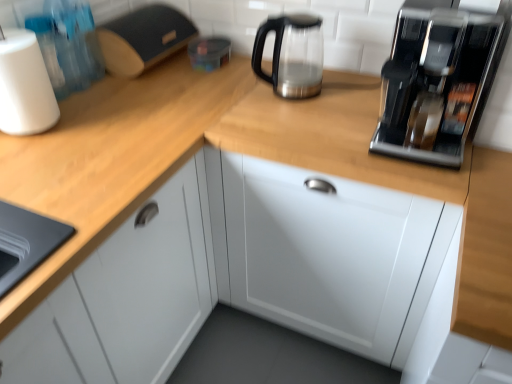
Question: Is white matte paper towel at left placed right next to wooden at left?

Choices:
 (A) no
 (B) yes

Answer: (A)

Question: Can you confirm if white matte paper towel at left is smaller than wooden at left?

Choices:
 (A) no
 (B) yes

Answer: (B)

Question: From the image's perspective, is white matte paper towel at left on top of wooden at left?

Choices:
 (A) yes
 (B) no

Answer: (A)

Question: Would you say wooden at left is part of white matte paper towel at left's contents?

Choices:
 (A) no
 (B) yes

Answer: (A)

Question: From a real-world perspective, is white matte paper towel at left on wooden at left?

Choices:
 (A) yes
 (B) no

Answer: (A)

Question: Which is correct: white glossy cabinet at center is inside sleek metallic coffee machine at upper right, or outside of it?

Choices:
 (A) outside
 (B) inside

Answer: (A)

Question: Considering the positions of white glossy cabinet at center and sleek metallic coffee machine at upper right in the image, is white glossy cabinet at center wider or thinner than sleek metallic coffee machine at upper right?

Choices:
 (A) thin
 (B) wide

Answer: (B)

Question: In terms of height, does white glossy cabinet at center look taller or shorter compared to sleek metallic coffee machine at upper right?

Choices:
 (A) short
 (B) tall

Answer: (B)

Question: Visually, is white glossy cabinet at center positioned to the left or to the right of sleek metallic coffee machine at upper right?

Choices:
 (A) right
 (B) left

Answer: (B)

Question: Is point (395, 31) positioned closer to the camera than point (261, 244)?

Choices:
 (A) farther
 (B) closer

Answer: (B)

Question: Would you say sleek metallic coffee machine at upper right is to the left or to the right of white glossy cabinet at center in the picture?

Choices:
 (A) right
 (B) left

Answer: (A)

Question: From the image's perspective, relative to white glossy cabinet at center, is sleek metallic coffee machine at upper right above or below?

Choices:
 (A) below
 (B) above

Answer: (B)

Question: Based on their sizes in the image, would you say sleek metallic coffee machine at upper right is bigger or smaller than white glossy cabinet at center?

Choices:
 (A) small
 (B) big

Answer: (A)

Question: Relative to wooden at left, is white matte paper towel at left in front or behind?

Choices:
 (A) behind
 (B) front

Answer: (A)

Question: From the image's perspective, is white matte paper towel at left located above or below wooden at left?

Choices:
 (A) above
 (B) below

Answer: (A)